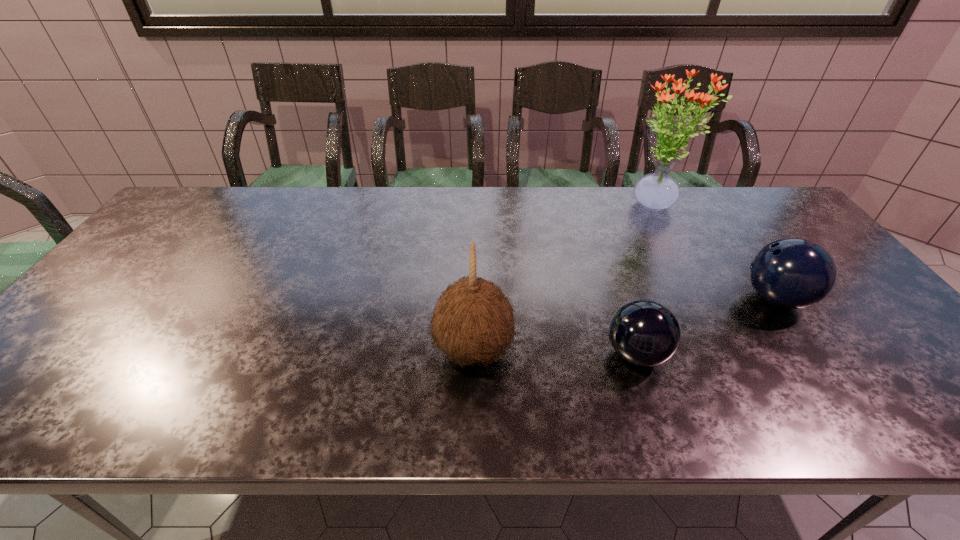
Find the location of a particular element. The height and width of the screenshot is (540, 960). the farthest object is located at coordinates (657, 191).

Find the location of a particular element. the tallest object is located at coordinates (657, 191).

Locate an element on the screen. The height and width of the screenshot is (540, 960). coconut is located at coordinates (473, 322).

You are a GUI agent. You are given a task and a screenshot of the screen. Output one action in this format:
    pyautogui.click(x=<x>, y=<y>)
    Task: Click on the leftmost object
    This screenshot has height=540, width=960.
    Given the screenshot: What is the action you would take?
    pyautogui.click(x=473, y=322)

This screenshot has height=540, width=960. In order to click on the right bowling ball in this screenshot , I will do `click(792, 273)`.

Locate an element on the screen. This screenshot has height=540, width=960. the taller bowling ball is located at coordinates pyautogui.click(x=792, y=273).

Find the location of `the left bowling ball`. the left bowling ball is located at coordinates (643, 332).

Where is `the nearer bowling ball`? the nearer bowling ball is located at coordinates (643, 332).

Where is `free space located on the right of the tallest object`? The height and width of the screenshot is (540, 960). free space located on the right of the tallest object is located at coordinates (751, 205).

This screenshot has height=540, width=960. Identify the location of free space located on the surface of the third shortest object. (538, 350).